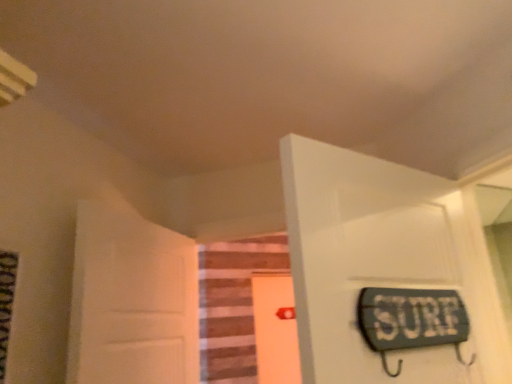
Question: From a real-world perspective, is wooden stairs at center under orange matte door at center, placed as the second door when sorted from right to left?

Choices:
 (A) yes
 (B) no

Answer: (B)

Question: Is wooden stairs at center positioned in front of orange matte door at center, arranged as the 2th door when viewed from the left?

Choices:
 (A) no
 (B) yes

Answer: (B)

Question: Are wooden stairs at center and orange matte door at center, placed as the second door when sorted from right to left, beside each other?

Choices:
 (A) yes
 (B) no

Answer: (B)

Question: From the image's perspective, is wooden stairs at center above orange matte door at center, acting as the first door starting from the back?

Choices:
 (A) no
 (B) yes

Answer: (B)

Question: Does wooden stairs at center turn towards orange matte door at center, acting as the first door starting from the back?

Choices:
 (A) no
 (B) yes

Answer: (A)

Question: Does wooden stairs at center appear on the right side of orange matte door at center, placed as the second door when sorted from right to left?

Choices:
 (A) no
 (B) yes

Answer: (A)

Question: Does orange matte door at center, the 3th door viewed from the front, have a smaller size compared to white glossy door at upper right, the 3th door in the left-to-right sequence?

Choices:
 (A) no
 (B) yes

Answer: (B)

Question: Can you confirm if orange matte door at center, the 3th door viewed from the front, is thinner than white glossy door at upper right, which is counted as the 1th door, starting from the front?

Choices:
 (A) no
 (B) yes

Answer: (B)

Question: Is orange matte door at center, the 3th door viewed from the front, positioned behind white glossy door at upper right, which is counted as the 1th door, starting from the front?

Choices:
 (A) no
 (B) yes

Answer: (B)

Question: Are orange matte door at center, arranged as the 2th door when viewed from the left, and white glossy door at upper right, the 3th door in the left-to-right sequence, beside each other?

Choices:
 (A) yes
 (B) no

Answer: (B)

Question: Is orange matte door at center, acting as the first door starting from the back, at the right side of white glossy door at upper right, the 3th door in the left-to-right sequence?

Choices:
 (A) no
 (B) yes

Answer: (A)

Question: From a real-world perspective, is orange matte door at center, arranged as the 2th door when viewed from the left, over white glossy door at upper right, the first door positioned from the right?

Choices:
 (A) yes
 (B) no

Answer: (B)

Question: From a real-world perspective, is white glossy door at upper right, the 3th door in the left-to-right sequence, positioned under white matte door at left, the 2th door viewed from the front, based on gravity?

Choices:
 (A) no
 (B) yes

Answer: (A)